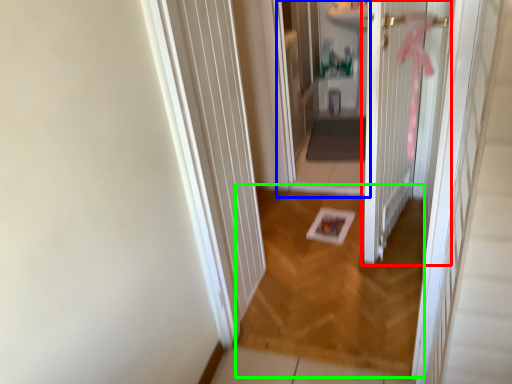
Question: Which is farther away from door (highlighted by a red box)? corridor (highlighted by a blue box) or plain (highlighted by a green box)?

Choices:
 (A) corridor
 (B) plain

Answer: (A)